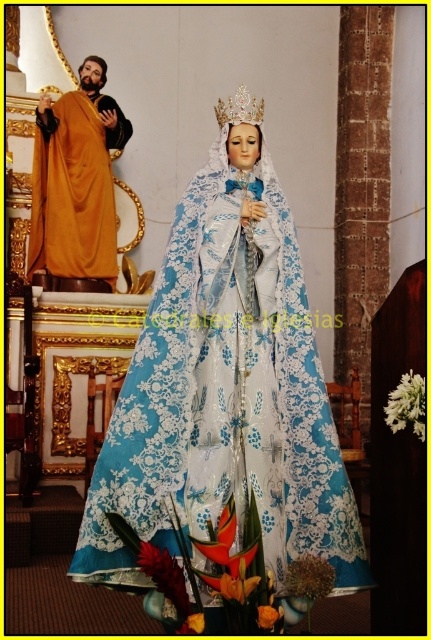
In the church scene, there is a lace fabric statue at center and a golden draped robe at left. Which object is larger in size?

The lace fabric statue at center is bigger than the golden draped robe at left.